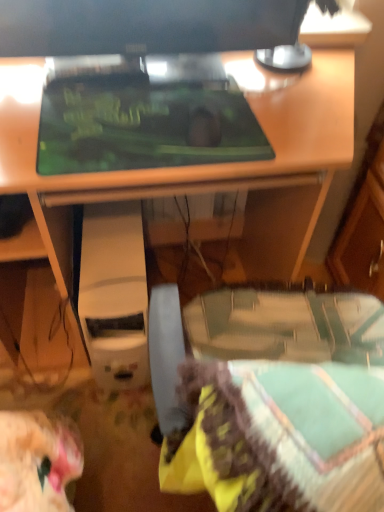
Question: Does green matte mousepad at center have a greater width compared to white plastic computer at center?

Choices:
 (A) yes
 (B) no

Answer: (B)

Question: Is green matte mousepad at center facing away from white plastic computer at center?

Choices:
 (A) yes
 (B) no

Answer: (B)

Question: Can you confirm if green matte mousepad at center is smaller than white plastic computer at center?

Choices:
 (A) yes
 (B) no

Answer: (A)

Question: Is green matte mousepad at center surrounding white plastic computer at center?

Choices:
 (A) yes
 (B) no

Answer: (B)

Question: Is green matte mousepad at center taller than white plastic computer at center?

Choices:
 (A) no
 (B) yes

Answer: (A)

Question: Is point (13, 147) closer or farther from the camera than point (200, 28)?

Choices:
 (A) closer
 (B) farther

Answer: (A)

Question: Relative to matte black monitor at upper center, is matte black desk at center in front or behind?

Choices:
 (A) behind
 (B) front

Answer: (B)

Question: Is matte black desk at center bigger or smaller than matte black monitor at upper center?

Choices:
 (A) small
 (B) big

Answer: (B)

Question: From a real-world perspective, is matte black desk at center physically located above or below matte black monitor at upper center?

Choices:
 (A) below
 (B) above

Answer: (A)

Question: In terms of size, does white plastic computer at center appear bigger or smaller than matte black monitor at upper center?

Choices:
 (A) big
 (B) small

Answer: (A)

Question: Is point (137, 381) closer or farther from the camera than point (281, 27)?

Choices:
 (A) closer
 (B) farther

Answer: (B)

Question: In the image, is white plastic computer at center on the left side or the right side of matte black monitor at upper center?

Choices:
 (A) right
 (B) left

Answer: (B)

Question: Choose the correct answer: Is white plastic computer at center inside matte black monitor at upper center or outside it?

Choices:
 (A) outside
 (B) inside

Answer: (A)

Question: Is point (233, 279) positioned closer to the camera than point (107, 168)?

Choices:
 (A) closer
 (B) farther

Answer: (B)

Question: Is matte black desk at center in front of or behind green matte mousepad at center in the image?

Choices:
 (A) front
 (B) behind

Answer: (A)